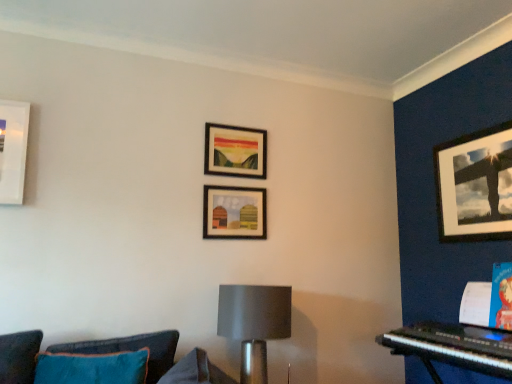
Image resolution: width=512 pixels, height=384 pixels. What do you see at coordinates (453, 347) in the screenshot?
I see `black plastic keyboard at lower right` at bounding box center [453, 347].

The image size is (512, 384). I want to click on matte black picture frame at upper center, acting as the 3th picture frame starting from the right, so click(234, 151).

How much space does matte black picture frame at upper center, acting as the 3th picture frame starting from the right, occupy horizontally?

matte black picture frame at upper center, acting as the 3th picture frame starting from the right, is 1.47 inches wide.

What is the approximate width of matte wooden picture frame at center, positioned as the second picture frame in right-to-left order?

The width of matte wooden picture frame at center, positioned as the second picture frame in right-to-left order, is 1.29 inches.

Where is `matte gray lampshade at center`? matte gray lampshade at center is located at coordinates (254, 323).

From the image's perspective, who appears lower, matte gray lampshade at center or matte wooden picture frame at center, which appears as the 2th picture frame when viewed from the left?

From the image's view, matte gray lampshade at center is below.

Which object is further away from the camera, matte gray lampshade at center or matte wooden picture frame at center, which appears as the 2th picture frame when viewed from the left?

matte wooden picture frame at center, which appears as the 2th picture frame when viewed from the left, is more distant.

Is matte gray lampshade at center shorter than matte wooden picture frame at center, which appears as the 2th picture frame when viewed from the left?

No, matte gray lampshade at center is not shorter than matte wooden picture frame at center, which appears as the 2th picture frame when viewed from the left.

Is matte gray lampshade at center in contact with matte wooden picture frame at center, which appears as the 2th picture frame when viewed from the left?

No, matte gray lampshade at center is not beside matte wooden picture frame at center, which appears as the 2th picture frame when viewed from the left.

In the scene shown: Which is more to the right, matte wooden picture frame at center, positioned as the second picture frame in right-to-left order, or matte black picture frame at upper right, the third picture frame in the left-to-right sequence?

Positioned to the right is matte black picture frame at upper right, the third picture frame in the left-to-right sequence.

Is matte wooden picture frame at center, which appears as the 2th picture frame when viewed from the left, aimed at matte black picture frame at upper right, the first picture frame from the right?

No, matte wooden picture frame at center, which appears as the 2th picture frame when viewed from the left, does not turn towards matte black picture frame at upper right, the first picture frame from the right.

From the picture: Considering the relative positions of matte wooden picture frame at center, positioned as the second picture frame in right-to-left order, and matte black picture frame at upper right, the third picture frame in the left-to-right sequence, in the image provided, is matte wooden picture frame at center, positioned as the second picture frame in right-to-left order, in front of matte black picture frame at upper right, the third picture frame in the left-to-right sequence,?

No, matte wooden picture frame at center, positioned as the second picture frame in right-to-left order, is further to the viewer.

Would you consider teal fabric couch at lower left to be distant from matte black picture frame at upper center, the first picture frame from the left?

Indeed, teal fabric couch at lower left is not near matte black picture frame at upper center, the first picture frame from the left.

Considering the positions of objects teal fabric couch at lower left and matte black picture frame at upper center, the first picture frame from the left, in the image provided, who is more to the left, teal fabric couch at lower left or matte black picture frame at upper center, the first picture frame from the left,?

teal fabric couch at lower left is more to the left.

Is matte black picture frame at upper center, the first picture frame from the left, a part of teal fabric couch at lower left?

No, teal fabric couch at lower left does not contain matte black picture frame at upper center, the first picture frame from the left.

Which of these two, black plastic keyboard at lower right or matte black picture frame at upper right, the third picture frame in the left-to-right sequence, is thinner?

matte black picture frame at upper right, the third picture frame in the left-to-right sequence.

What's the angular difference between black plastic keyboard at lower right and matte black picture frame at upper right, the first picture frame from the right,'s facing directions?

The facing directions of black plastic keyboard at lower right and matte black picture frame at upper right, the first picture frame from the right, are 1.56 degrees apart.

Find the location of a particular element. Image resolution: width=512 pixels, height=384 pixels. piano in front of the matte black picture frame at upper right, the third picture frame in the left-to-right sequence is located at coordinates (453, 347).

Is teal fabric couch at lower left directly adjacent to matte gray lampshade at center?

They are not placed beside each other.

Is matte gray lampshade at center at the back of teal fabric couch at lower left?

No, teal fabric couch at lower left's orientation is not away from matte gray lampshade at center.

From the image's perspective, is teal fabric couch at lower left above or below matte gray lampshade at center?

teal fabric couch at lower left is above matte gray lampshade at center.

Which is nearer, [5,378] or [275,317]?

The point [5,378] is closer.

From a real-world perspective, is matte wooden picture frame at center, positioned as the second picture frame in right-to-left order, positioned over matte gray lampshade at center based on gravity?

Yes, from a real-world perspective, matte wooden picture frame at center, positioned as the second picture frame in right-to-left order, is over matte gray lampshade at center

Starting from the matte gray lampshade at center, which picture frame is the 2nd one behind? Please provide its 2D coordinates.

[(234, 213)]

Is matte wooden picture frame at center, positioned as the second picture frame in right-to-left order, wider than matte gray lampshade at center?

No, matte wooden picture frame at center, positioned as the second picture frame in right-to-left order, is not wider than matte gray lampshade at center.

Can you confirm if matte gray lampshade at center is bigger than black plastic keyboard at lower right?

Yes.

Between matte gray lampshade at center and black plastic keyboard at lower right, which one has larger width?

Wider between the two is black plastic keyboard at lower right.

Considering the relative positions of matte gray lampshade at center and black plastic keyboard at lower right in the image provided, is matte gray lampshade at center in front of black plastic keyboard at lower right?

No, it is not.

From the image's perspective, count 1st picture frames upward from the matte gray lampshade at center and point to it. Please provide its 2D coordinates.

[(234, 213)]

Where is `picture frame that appears on the right of matte wooden picture frame at center, positioned as the second picture frame in right-to-left order`? The image size is (512, 384). picture frame that appears on the right of matte wooden picture frame at center, positioned as the second picture frame in right-to-left order is located at coordinates (475, 185).

From the image, which object appears to be farther from matte black picture frame at upper center, the first picture frame from the left, matte black picture frame at upper right, the first picture frame from the right, or teal fabric couch at lower left?

The object further to matte black picture frame at upper center, the first picture frame from the left, is matte black picture frame at upper right, the first picture frame from the right.

Which object lies nearer to the anchor point matte wooden picture frame at center, positioned as the second picture frame in right-to-left order, matte gray lampshade at center or black plastic keyboard at lower right?

matte gray lampshade at center is closer to matte wooden picture frame at center, positioned as the second picture frame in right-to-left order.

Looking at the image, which one is located closer to matte gray lampshade at center, matte black picture frame at upper right, the third picture frame in the left-to-right sequence, or matte black picture frame at upper center, acting as the 3th picture frame starting from the right?

matte black picture frame at upper center, acting as the 3th picture frame starting from the right, lies closer to matte gray lampshade at center than the other object.

Considering their positions, is matte black picture frame at upper center, the first picture frame from the left, positioned further to black plastic keyboard at lower right than matte gray lampshade at center?

The object further to black plastic keyboard at lower right is matte black picture frame at upper center, the first picture frame from the left.

Considering their positions, is matte black picture frame at upper center, acting as the 3th picture frame starting from the right, positioned closer to matte wooden picture frame at center, which appears as the 2th picture frame when viewed from the left, than matte gray lampshade at center?

Among the two, matte black picture frame at upper center, acting as the 3th picture frame starting from the right, is located nearer to matte wooden picture frame at center, which appears as the 2th picture frame when viewed from the left.

Which object lies nearer to the anchor point matte black picture frame at upper right, the third picture frame in the left-to-right sequence, black plastic keyboard at lower right or teal fabric couch at lower left?

black plastic keyboard at lower right is positioned closer to the anchor matte black picture frame at upper right, the third picture frame in the left-to-right sequence.

Which object lies further to the anchor point matte black picture frame at upper center, acting as the 3th picture frame starting from the right, matte wooden picture frame at center, which appears as the 2th picture frame when viewed from the left, or matte black picture frame at upper right, the third picture frame in the left-to-right sequence?

Among the two, matte black picture frame at upper right, the third picture frame in the left-to-right sequence, is located further to matte black picture frame at upper center, acting as the 3th picture frame starting from the right.

When comparing their distances from matte black picture frame at upper center, the first picture frame from the left, does matte gray lampshade at center or teal fabric couch at lower left seem further?

Based on the image, teal fabric couch at lower left appears to be further to matte black picture frame at upper center, the first picture frame from the left.

Find the location of a particular element. piano between matte black picture frame at upper center, acting as the 3th picture frame starting from the right, and matte black picture frame at upper right, the third picture frame in the left-to-right sequence, in the horizontal direction is located at coordinates (453, 347).

Identify the location of lamp between teal fabric couch at lower left and matte wooden picture frame at center, which appears as the 2th picture frame when viewed from the left, along the z-axis. The width and height of the screenshot is (512, 384). (254, 323).

Locate an element on the screen. lamp between matte wooden picture frame at center, which appears as the 2th picture frame when viewed from the left, and black plastic keyboard at lower right is located at coordinates (254, 323).

Identify the location of picture frame situated between matte black picture frame at upper center, the first picture frame from the left, and matte black picture frame at upper right, the third picture frame in the left-to-right sequence, from left to right. (234, 213).